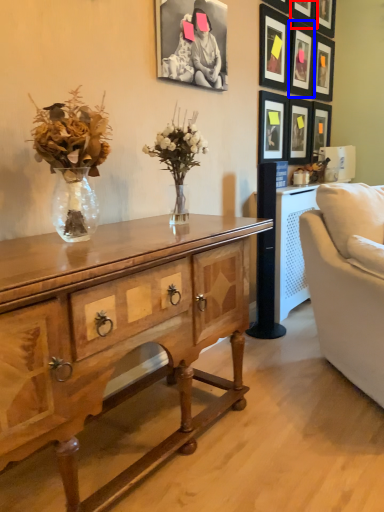
Question: Among these objects, which one is nearest to the camera, picture frame (highlighted by a red box) or picture frame (highlighted by a blue box)?

Choices:
 (A) picture frame
 (B) picture frame

Answer: (A)